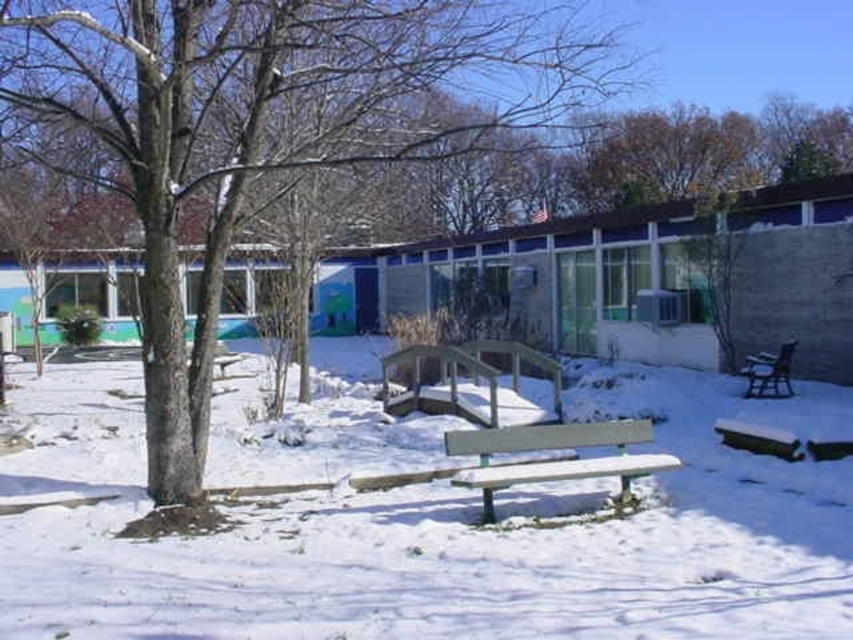
Question: Which point is farther to the camera?

Choices:
 (A) (643, 426)
 (B) (531, 108)
 (C) (753, 566)

Answer: (A)

Question: Is light brown wood bench at center smaller than dark brown wooden bench at right?

Choices:
 (A) yes
 (B) no

Answer: (B)

Question: Considering the relative positions of brown rough tree at center and dark brown wooden bench at right in the image provided, where is brown rough tree at center located with respect to dark brown wooden bench at right?

Choices:
 (A) left
 (B) right

Answer: (A)

Question: Among these points, which one is nearest to the camera?

Choices:
 (A) (462, 118)
 (B) (532, 586)
 (C) (555, 440)
 (D) (776, 356)

Answer: (B)

Question: Based on their relative distances, which object is farther from the white matte snow at center?

Choices:
 (A) light brown wood bench at center
 (B) dark brown wooden bench at right
 (C) brown rough tree at center

Answer: (C)

Question: Is brown rough tree at center above light brown wood bench at center?

Choices:
 (A) no
 (B) yes

Answer: (B)